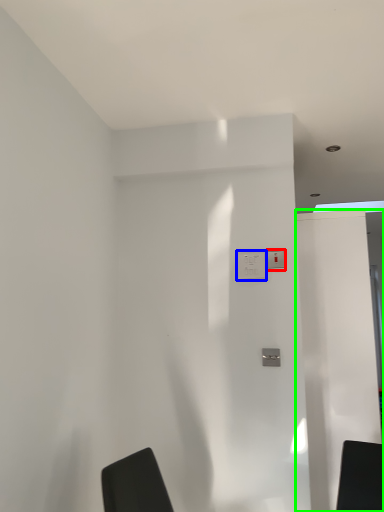
Question: Based on their relative distances, which object is nearer to light switch (highlighted by a red box)? Choose from electric outlet (highlighted by a blue box) and screen door (highlighted by a green box).

Choices:
 (A) electric outlet
 (B) screen door

Answer: (A)